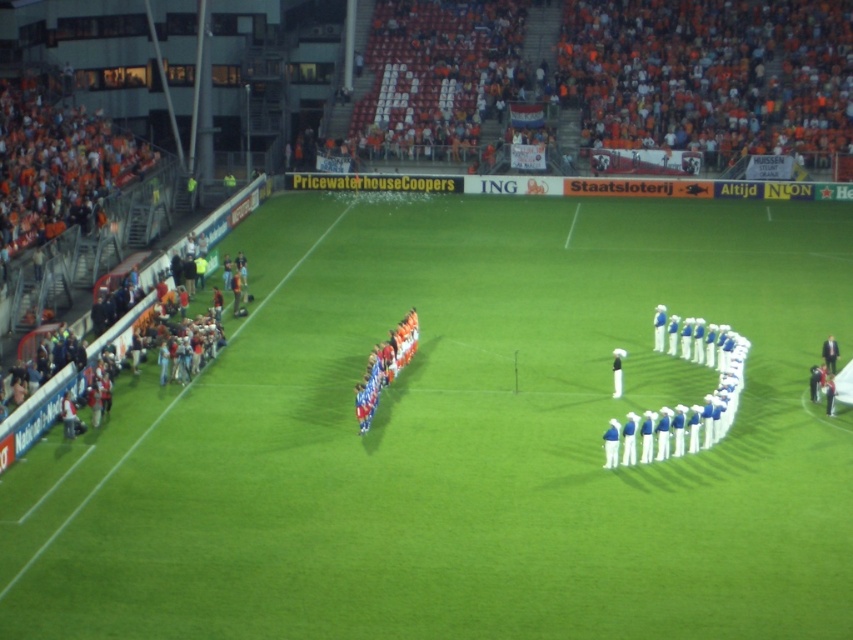
Question: Does white cotton uniform at center have a lesser width compared to blue uniformed people at center?

Choices:
 (A) no
 (B) yes

Answer: (A)

Question: Which point is farther to the camera?

Choices:
 (A) blue uniformed people at center
 (B) white fabric person at center
 (C) green grass football field at center

Answer: (A)

Question: From the image, what is the correct spatial relationship of blue uniformed people at center in relation to dark suit at center?

Choices:
 (A) below
 (B) above

Answer: (B)

Question: Which is nearer to the white fabric person at center?

Choices:
 (A) white cotton uniform at center
 (B) blue uniformed people at center

Answer: (A)

Question: Does white cotton uniform at center come behind white fabric person at center?

Choices:
 (A) yes
 (B) no

Answer: (B)

Question: Based on their relative distances, which object is nearer to the white fabric person at center?

Choices:
 (A) dark suit at center
 (B) green grass football field at center

Answer: (A)